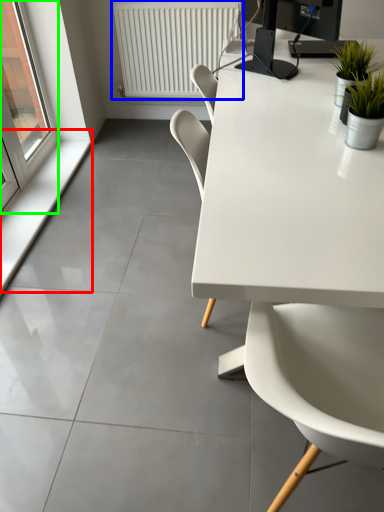
Question: Which object is positioned farthest from window sill (highlighted by a red box)? Select from radiator (highlighted by a blue box) and window (highlighted by a green box).

Choices:
 (A) radiator
 (B) window

Answer: (A)